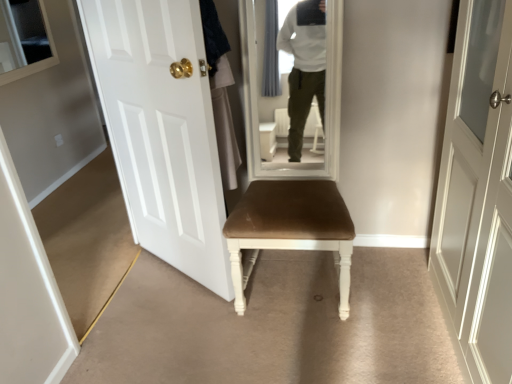
This screenshot has width=512, height=384. I want to click on space that is in front of brown velvet chair at center, so click(310, 348).